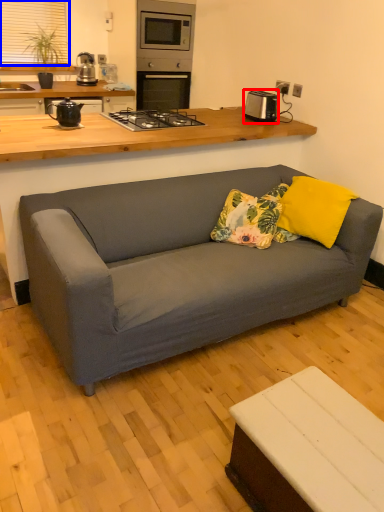
Question: Which object appears farthest to the camera in this image, appliance (highlighted by a red box) or window screen (highlighted by a blue box)?

Choices:
 (A) appliance
 (B) window screen

Answer: (B)